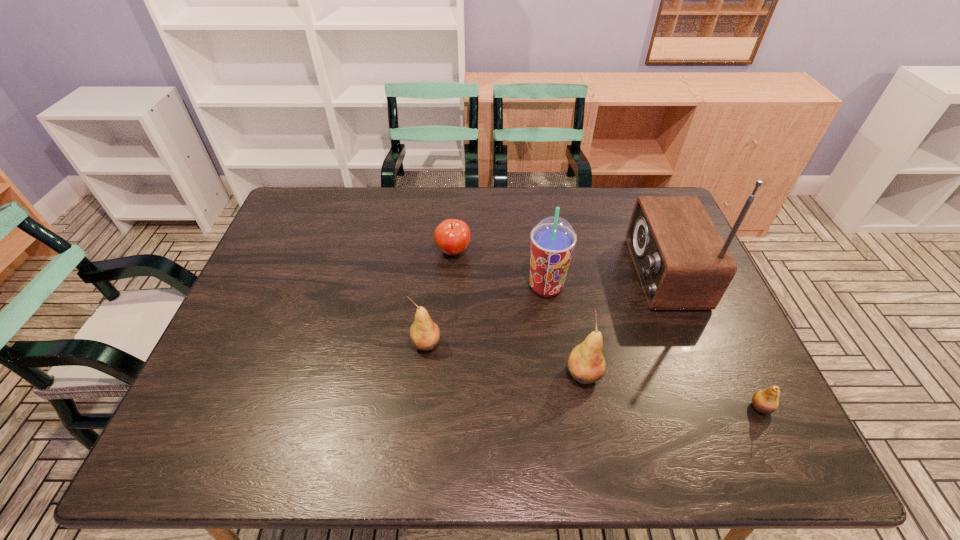
I want to click on vacant space at the far edge of the desktop, so click(490, 211).

The height and width of the screenshot is (540, 960). I want to click on vacant space at the near edge of the desktop, so click(x=596, y=414).

At what (x,y) coordinates should I click in order to perform the action: click on vacant region at the left edge. Please return your answer as a coordinate pair (x, y). Looking at the image, I should click on (310, 245).

At what (x,y) coordinates should I click in order to perform the action: click on vacant space at the right edge. Please return your answer as a coordinate pair (x, y). Looking at the image, I should click on (724, 340).

Identify the location of free space at the far left corner of the desktop. (290, 223).

You are a GUI agent. You are given a task and a screenshot of the screen. Output one action in this format:
    pyautogui.click(x=<x>, y=<y>)
    Task: Click on the vacant space at the near left corner of the desktop
    
    Given the screenshot: What is the action you would take?
    pyautogui.click(x=255, y=404)

This screenshot has width=960, height=540. I want to click on free space between the apple and the leftmost pear, so click(440, 298).

This screenshot has width=960, height=540. I want to click on vacant area between the apple and the second farthest pear, so [518, 313].

I want to click on vacant area that lies between the apple and the second farthest pear, so click(518, 313).

Where is `free space between the second pear from left to right and the farthest pear`? The image size is (960, 540). free space between the second pear from left to right and the farthest pear is located at coordinates pos(505,359).